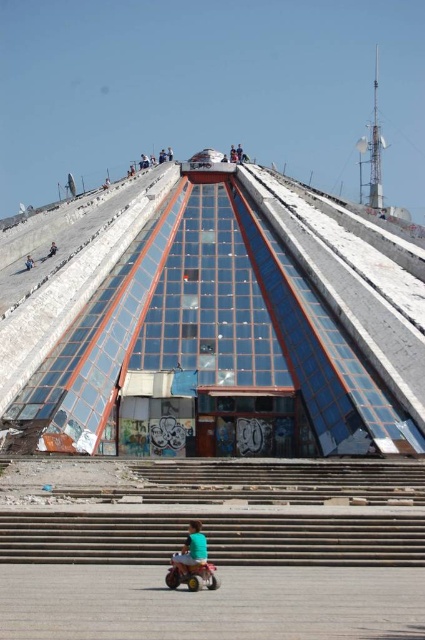
Question: Does concrete stairs at lower center come in front of dark blue fabric at upper center?

Choices:
 (A) yes
 (B) no

Answer: (A)

Question: Can you confirm if concrete stairs at lower center is bigger than dark blue fabric at upper center?

Choices:
 (A) no
 (B) yes

Answer: (B)

Question: Which of the following is the closest to the observer?

Choices:
 (A) (297, 493)
 (B) (2, 403)

Answer: (A)

Question: Is transparent glass pyramid at upper center wider than dark blue jeans at upper center?

Choices:
 (A) no
 (B) yes

Answer: (B)

Question: Among these objects, which one is nearest to the camera?

Choices:
 (A) concrete stairs at lower center
 (B) dark blue fabric at upper center
 (C) dark blue jeans at upper center
 (D) green fabric shirt at lower center

Answer: (D)

Question: Which point is closer to the camera taking this photo?

Choices:
 (A) (30, 266)
 (B) (272, 538)

Answer: (B)